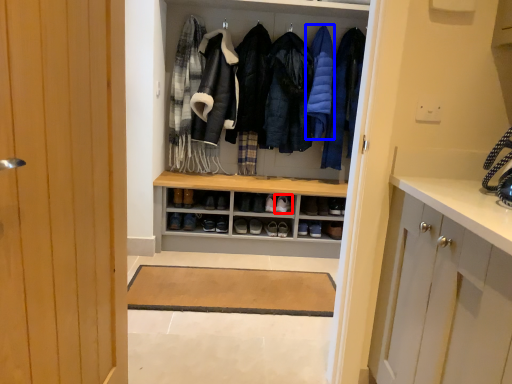
Question: Which point is closer to the camera, footwear (highlighted by a red box) or garment (highlighted by a blue box)?

Choices:
 (A) footwear
 (B) garment

Answer: (B)